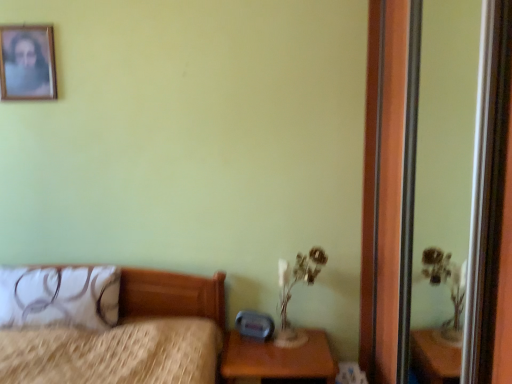
Where is `vacant space underneath translucent glass table lamp at lower right (from a real-world perspective)`? Image resolution: width=512 pixels, height=384 pixels. vacant space underneath translucent glass table lamp at lower right (from a real-world perspective) is located at coordinates (292, 335).